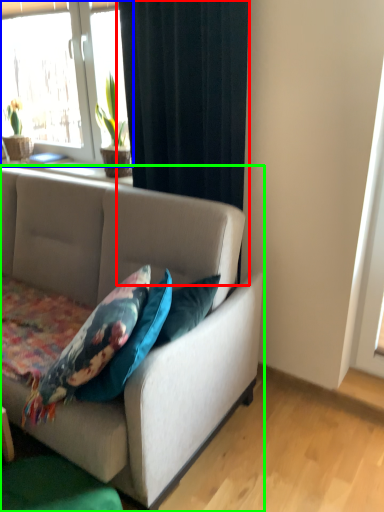
Question: Which object is positioned closest to curtain (highlighted by a red box)? Select from window (highlighted by a blue box) and studio couch (highlighted by a green box).

Choices:
 (A) window
 (B) studio couch

Answer: (B)